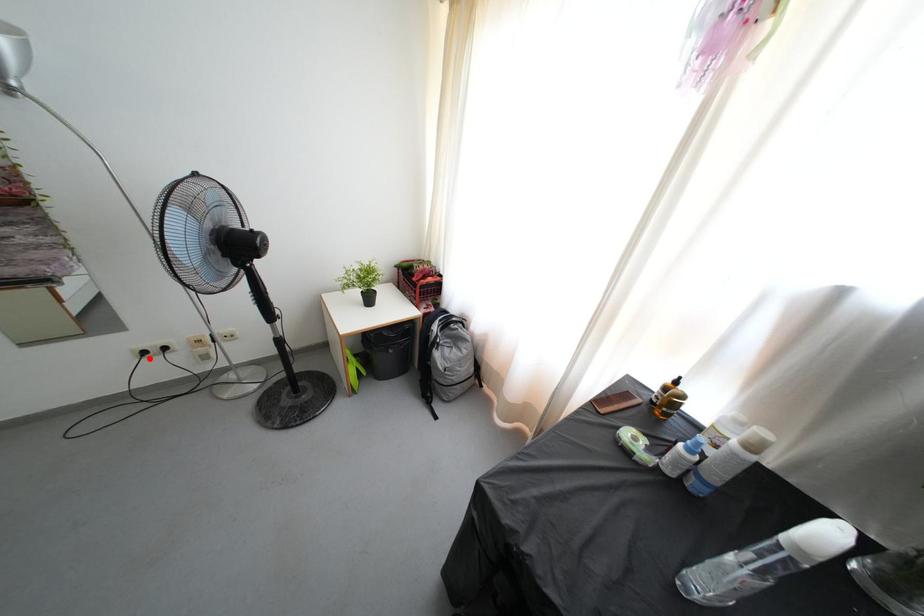
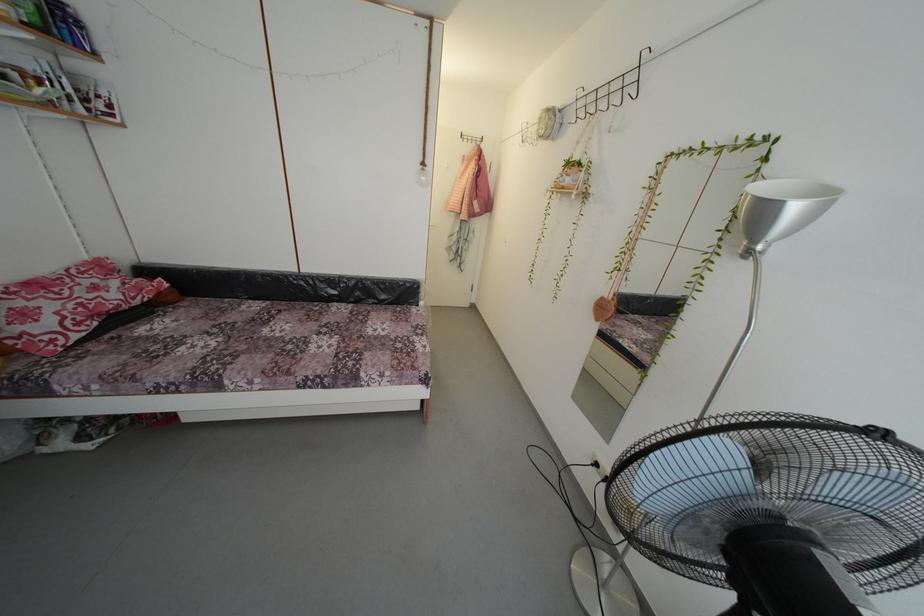
Question: I am providing you with two images of the same scene from different viewpoints. A red point is shown in image1. For the corresponding object point in image2, is it positioned nearer or farther from the camera?

Choices:
 (A) Nearer
 (B) Farther

Answer: (B)